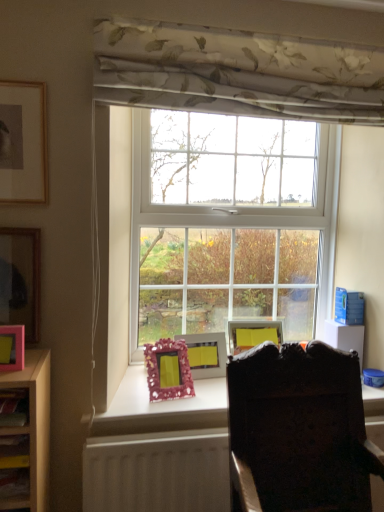
Locate an element on the screen. vacant area that is situated to the right of pink glittery picture frame at center, which ranks as the 2th picture frame in back-to-front order is located at coordinates (211, 390).